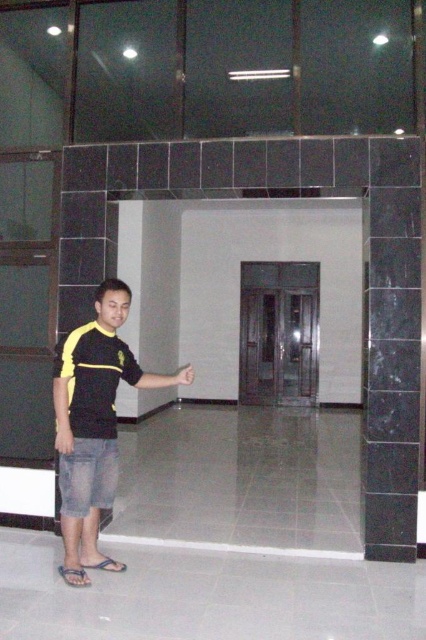
Question: From the image, what is the correct spatial relationship of gray fabric sandal at lower left in relation to skinny yellow shirt sleeve at lower left?

Choices:
 (A) below
 (B) above

Answer: (A)

Question: Where is metallic glass elevator at center located in relation to gray fabric sandal at lower left in the image?

Choices:
 (A) below
 (B) above

Answer: (B)

Question: Which object appears farthest from the camera in this image?

Choices:
 (A) gray fabric sandal at lower left
 (B) metallic glass elevator at center
 (C) yellow-black shirt at left

Answer: (B)

Question: Which of the following is the farthest from the observer?

Choices:
 (A) [103, 566]
 (B) [71, 573]

Answer: (A)

Question: Which of the following is the closest to the observer?

Choices:
 (A) blue rubber sandal at lower left
 (B) skinny yellow shirt sleeve at lower left

Answer: (B)

Question: Can you confirm if blue rubber sandal at lower left is smaller than skinny yellow shirt sleeve at lower left?

Choices:
 (A) yes
 (B) no

Answer: (A)